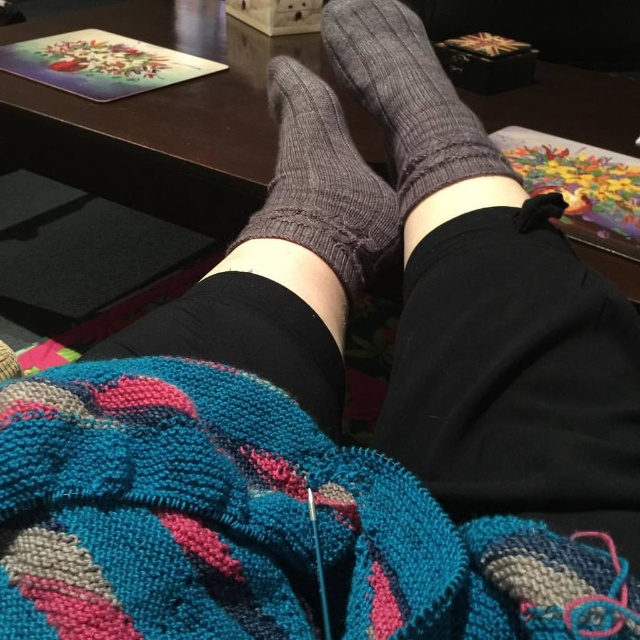
Can you confirm if wooden table at upper center is wider than knit fabric socks at center?

Indeed, wooden table at upper center has a greater width compared to knit fabric socks at center.

Does wooden table at upper center have a lesser height compared to knit fabric socks at center?

Incorrect, wooden table at upper center's height does not fall short of knit fabric socks at center's.

Identify the location of wooden table at upper center. (166, 116).

Looking at this image, who is shorter, knitted fabric leg at center or wooden table at upper center?

knitted fabric leg at center

Is point (420, 330) closer to camera compared to point (163, 205)?

Yes, point (420, 330) is in front of point (163, 205).

The image size is (640, 640). In order to click on knitted fabric leg at center in this screenshot , I will do `click(492, 314)`.

What are the coordinates of `knitted woolen blanket at lower center` in the screenshot? It's located at (256, 524).

Does knitted woolen blanket at lower center appear over knitted fabric sock at center?

Actually, knitted woolen blanket at lower center is below knitted fabric sock at center.

Is point (148, 544) positioned after point (257, 278)?

No, (148, 544) is closer to viewer.

Where is `knitted woolen blanket at lower center`? The width and height of the screenshot is (640, 640). knitted woolen blanket at lower center is located at coordinates (256, 524).